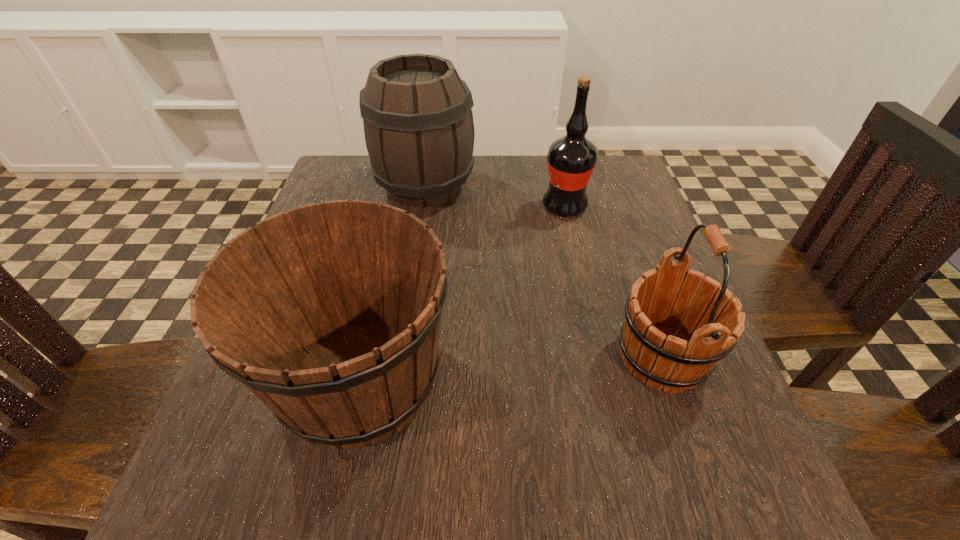
I want to click on wine bottle, so click(571, 159).

The width and height of the screenshot is (960, 540). In order to click on the farthest wine bucket in this screenshot , I will do `click(417, 114)`.

The width and height of the screenshot is (960, 540). What are the coordinates of `the rightmost wine bucket` in the screenshot? It's located at (676, 330).

This screenshot has height=540, width=960. What are the coordinates of `vacant area situated 0.160m on the left of the wine bottle` in the screenshot? It's located at (473, 207).

The width and height of the screenshot is (960, 540). I want to click on vacant space located on the front of the farthest wine bucket, so click(396, 367).

Identify the location of vacant space positioned on the back of the rightmost wine bucket. Image resolution: width=960 pixels, height=540 pixels. (637, 288).

You are a GUI agent. You are given a task and a screenshot of the screen. Output one action in this format:
    pyautogui.click(x=<x>, y=<y>)
    Task: Click on the wine bottle present at the far edge
    
    Given the screenshot: What is the action you would take?
    coord(571,159)

The width and height of the screenshot is (960, 540). I want to click on wine bucket located in the far edge section of the desktop, so click(417, 114).

Where is `object located at the near edge`? The image size is (960, 540). object located at the near edge is located at coordinates (330, 314).

Identify the location of wine bottle at the right edge. The width and height of the screenshot is (960, 540). (571, 159).